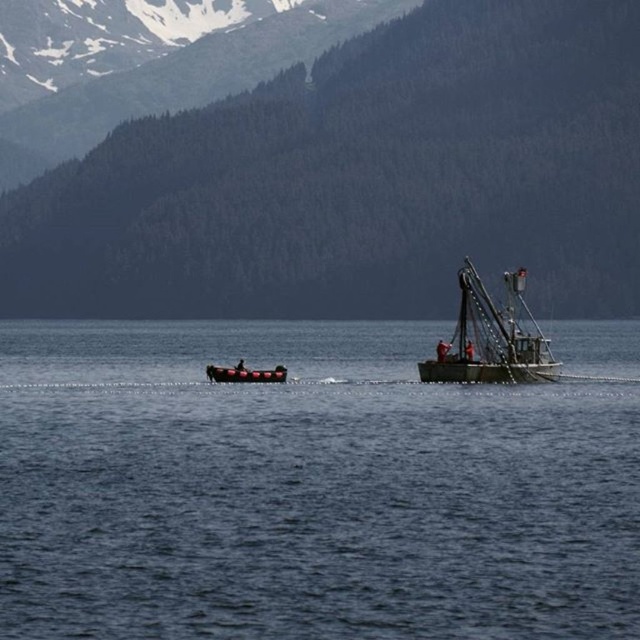
You are a photographer planning to capture a wide shot of the greenish metallic fishing boat at center from the green forested mountain at upper center. Given that your camera can focus up to 100 meters, will you be able to take a clear photo?

The green forested mountain at upper center is 125.40 meters from the greenish metallic fishing boat at center. Since the camera can only focus up to 100 meters, you will not be able to take a clear photo because the distance exceeds the camera range.

You are standing on a cliff overlooking the greenish metallic fishing boat at center. You want to throw a lifebuoy to someone on the boat. The lifebuoy can travel 1000 feet. Will it reach the boat?

The greenish metallic fishing boat at center is 1152.25 feet away from the viewer. Since the lifebuoy can only travel 1000 feet, it will not reach the boat.

You are a photographer planning to capture the green forested mountain at upper center and the greenish metallic fishing boat at center in a single frame. Considering their sizes in the image, which object will appear taller in the photograph?

The green forested mountain at upper center will appear taller in the photograph because it has a greater height compared to the greenish metallic fishing boat at center.